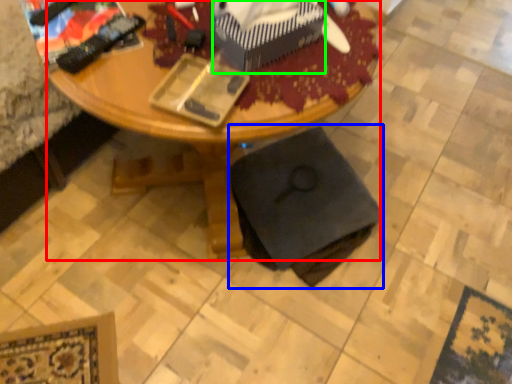
Question: Which object is the farthest from desk (highlighted by a red box)? Choose among these: swivel chair (highlighted by a blue box) or box (highlighted by a green box).

Choices:
 (A) swivel chair
 (B) box

Answer: (B)